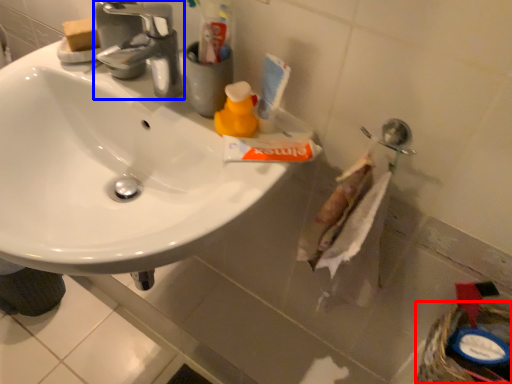
Question: Which object is further to the camera taking this photo, basket (highlighted by a red box) or tap (highlighted by a blue box)?

Choices:
 (A) basket
 (B) tap

Answer: (A)